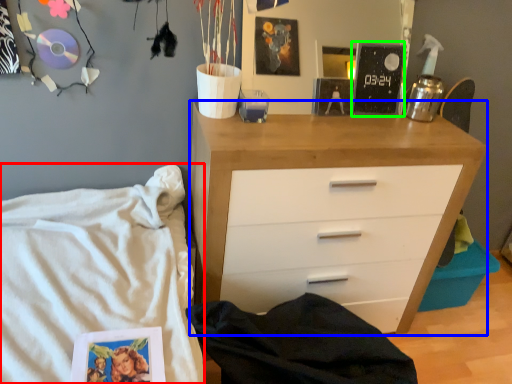
Question: Which object is positioned farthest from bed (highlighted by a red box)? Select from chest of drawers (highlighted by a blue box) and magazine (highlighted by a green box).

Choices:
 (A) chest of drawers
 (B) magazine

Answer: (B)